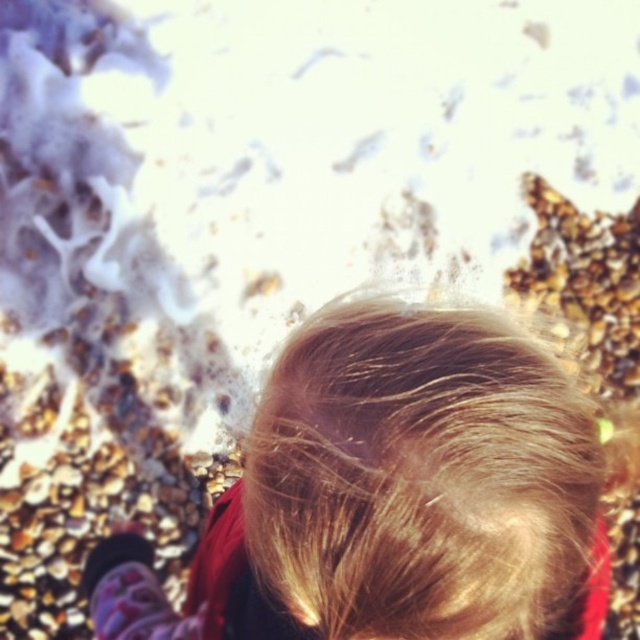
Question: Which object is farther from the camera taking this photo?

Choices:
 (A) blonde silky hair at center
 (B) blonde hair at center

Answer: (A)

Question: Which point is farther from the camera taking this photo?

Choices:
 (A) (636, 474)
 (B) (531, 378)

Answer: (A)

Question: Is blonde hair at center below blonde silky hair at center?

Choices:
 (A) no
 (B) yes

Answer: (B)

Question: Among these objects, which one is nearest to the camera?

Choices:
 (A) blonde hair at center
 (B) blonde silky hair at center

Answer: (A)

Question: Does blonde hair at center have a smaller size compared to blonde silky hair at center?

Choices:
 (A) no
 (B) yes

Answer: (A)

Question: Considering the relative positions of blonde hair at center and blonde silky hair at center in the image provided, where is blonde hair at center located with respect to blonde silky hair at center?

Choices:
 (A) above
 (B) below

Answer: (B)